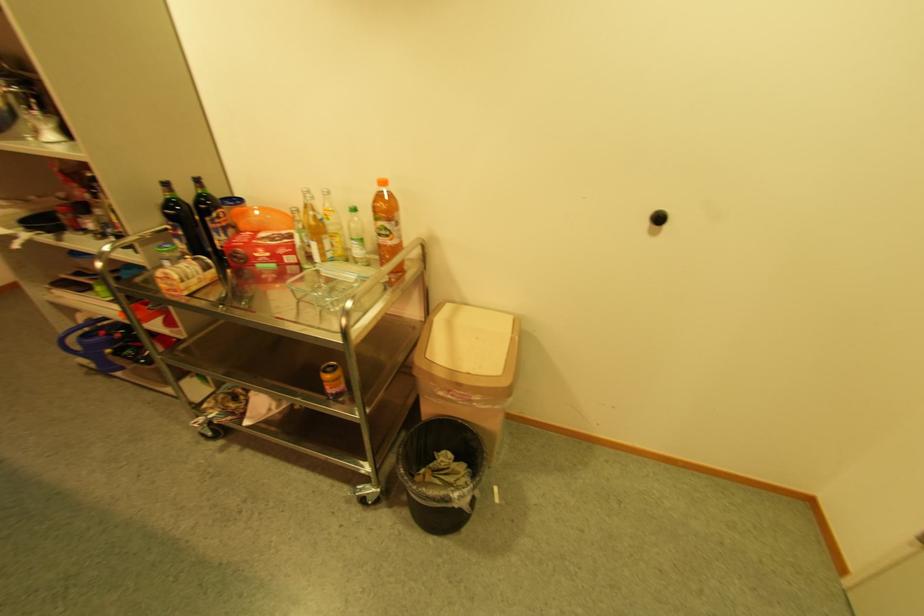
Identify the location of red cardboard box. The width and height of the screenshot is (924, 616). (262, 256).